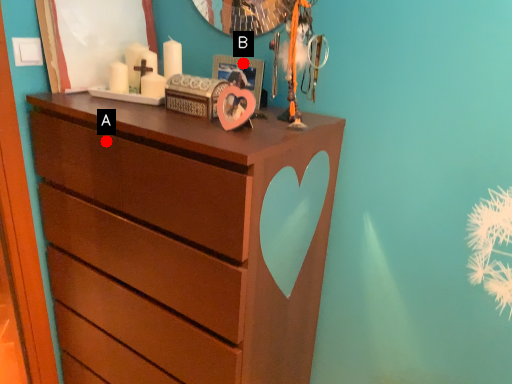
Question: Two points are circled on the image, labeled by A and B beside each circle. Which point appears closest to the camera in this image?

Choices:
 (A) A is closer
 (B) B is closer

Answer: (A)